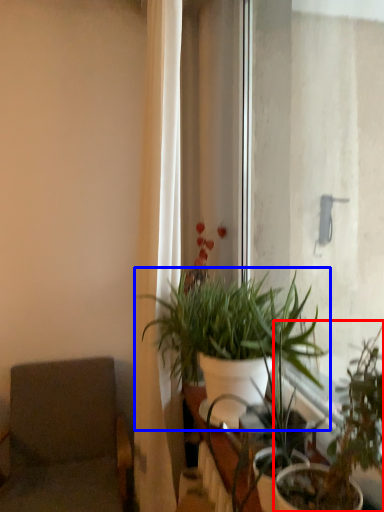
Question: Which object is closer to the camera taking this photo, houseplant (highlighted by a red box) or houseplant (highlighted by a blue box)?

Choices:
 (A) houseplant
 (B) houseplant

Answer: (A)